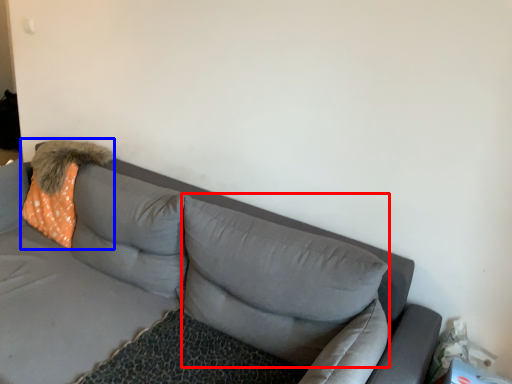
Question: Among these objects, which one is farthest to the camera, pillow (highlighted by a red box) or throw pillow (highlighted by a blue box)?

Choices:
 (A) pillow
 (B) throw pillow

Answer: (B)